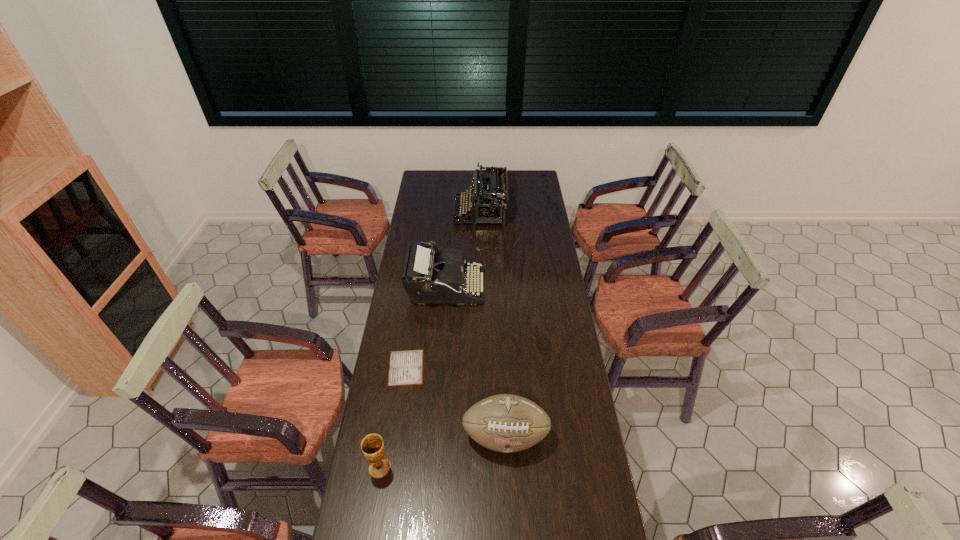
Locate an element on the screen. the third closest object relative to the football (American) is located at coordinates (429, 277).